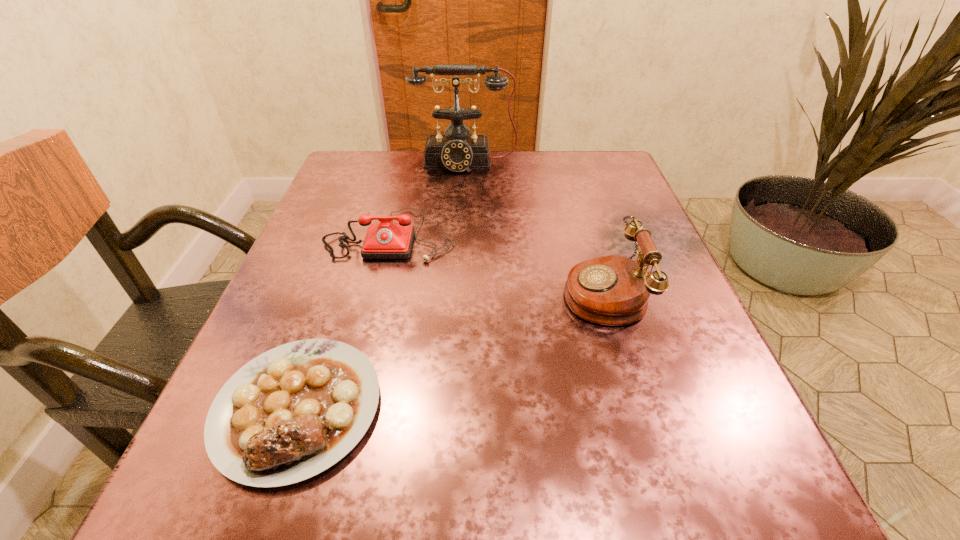
In the image, there is a desktop. Where is `vacant space at the left edge`? The image size is (960, 540). vacant space at the left edge is located at coordinates (348, 229).

In the image, there is a desktop. At what (x,y) coordinates should I click in order to perform the action: click on free space at the right edge. Please return your answer as a coordinate pair (x, y). This screenshot has width=960, height=540. Looking at the image, I should click on (602, 235).

Where is `free location at the far left corner`? free location at the far left corner is located at coordinates (390, 153).

Find the location of `vacant space at the far right corner of the desktop`. vacant space at the far right corner of the desktop is located at coordinates (579, 186).

This screenshot has height=540, width=960. What are the coordinates of `vacant space that's between the nearest object and the farthest object` in the screenshot? It's located at (381, 285).

The width and height of the screenshot is (960, 540). I want to click on free space between the nearest object and the third tallest object, so click(x=344, y=321).

The width and height of the screenshot is (960, 540). Identify the location of free point between the tallest object and the shortest telephone. (428, 199).

Identify the location of free point between the steak and the second tallest telephone. The width and height of the screenshot is (960, 540). (450, 349).

Locate an element on the screen. This screenshot has height=540, width=960. free space between the rightmost telephone and the second shortest object is located at coordinates (496, 263).

In order to click on free spot between the farthest object and the third shortest object in this screenshot , I will do `click(534, 227)`.